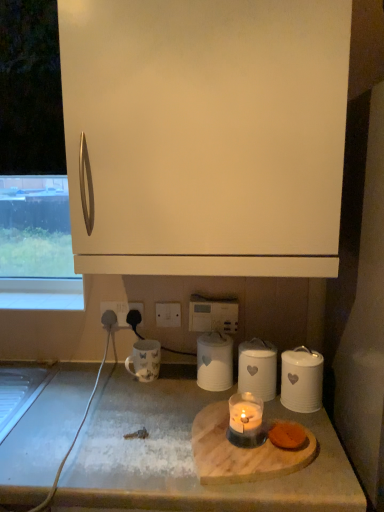
You are a GUI agent. You are given a task and a screenshot of the screen. Output one action in this format:
    pyautogui.click(x=<x>, y=<y>)
    Task: Click on the vacant space in between wooden cutting board at center and white glossy mug at lower left
    
    Given the screenshot: What is the action you would take?
    pyautogui.click(x=166, y=402)